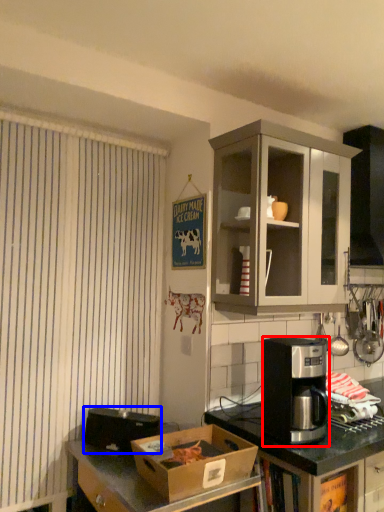
Question: Which point is further to the camera, coffee maker (highlighted by a red box) or appliance (highlighted by a blue box)?

Choices:
 (A) coffee maker
 (B) appliance

Answer: (B)